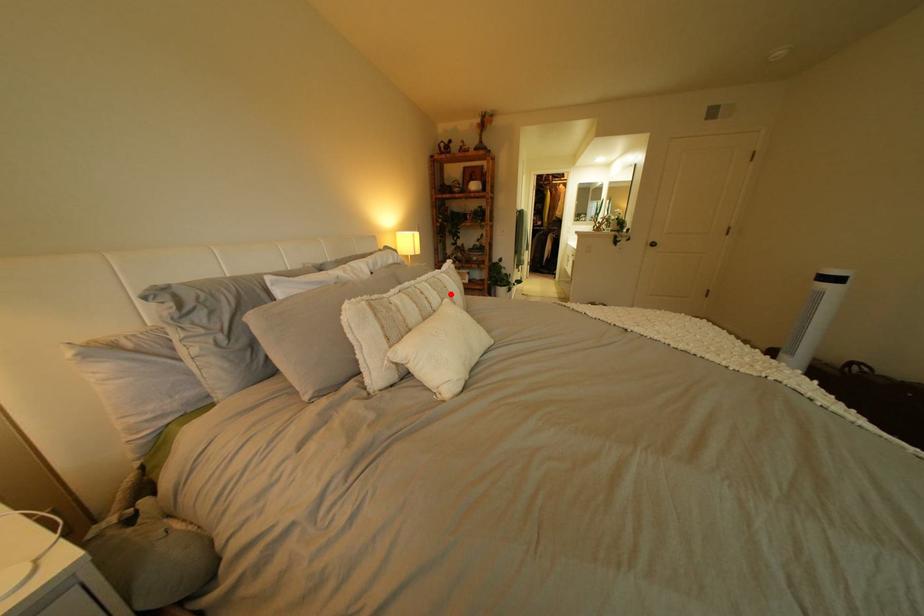
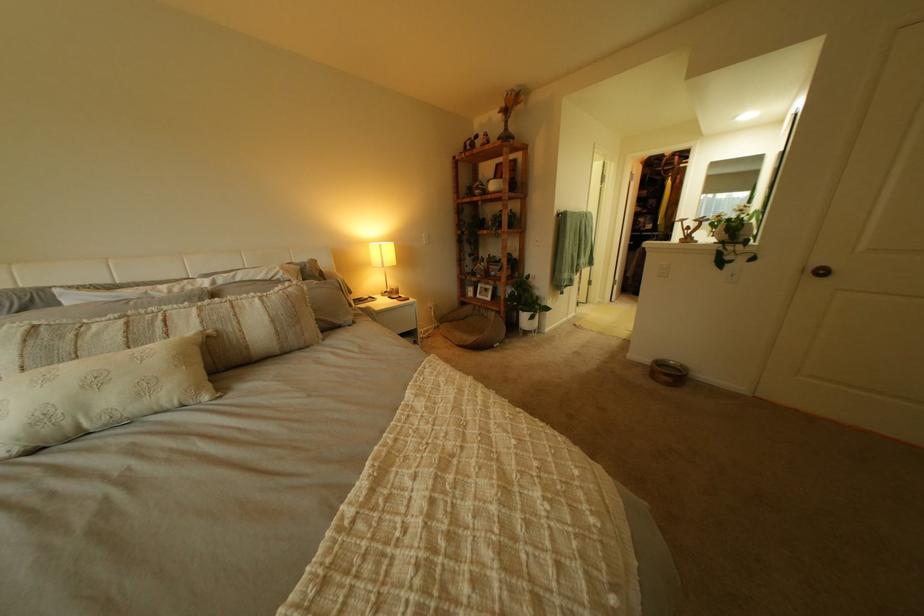
Find the pixel in the second image that matches the highlighted location in the first image.

(213, 323)